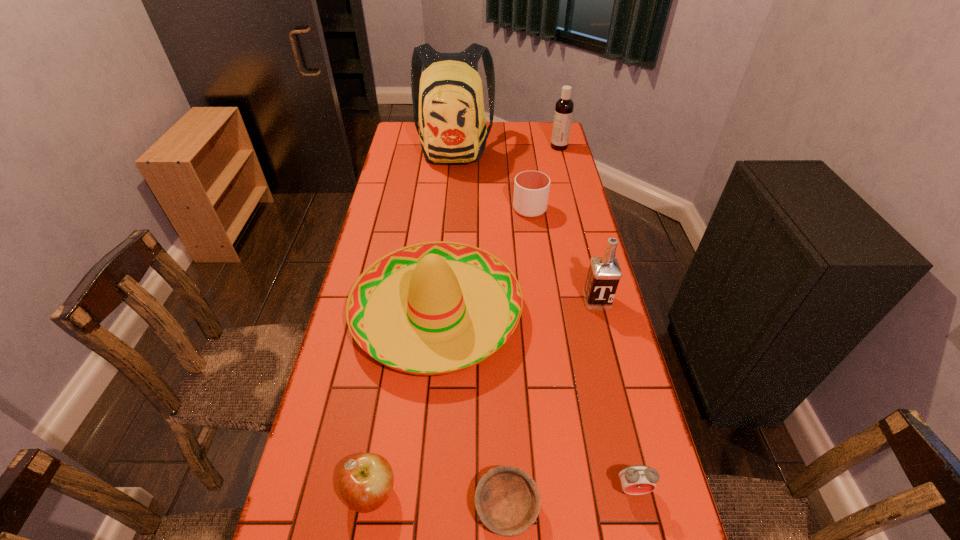
Locate an element on the screen. The height and width of the screenshot is (540, 960). the tallest object is located at coordinates pos(447,98).

Locate an element on the screen. dishwasher detergent is located at coordinates (564, 106).

Where is `vodka`? vodka is located at coordinates (604, 273).

The width and height of the screenshot is (960, 540). I want to click on sombrero, so click(x=433, y=308).

Locate an element on the screen. the third farthest object is located at coordinates 531,188.

Locate an element on the screen. the fourth object from right to left is located at coordinates (531, 188).

Find the location of a particular element. This screenshot has width=960, height=540. alarm clock is located at coordinates pos(638,479).

This screenshot has width=960, height=540. Find the location of `apple`. apple is located at coordinates (366, 480).

Image resolution: width=960 pixels, height=540 pixels. Find the location of `vacant space located on the front-facing side of the tallest object`. vacant space located on the front-facing side of the tallest object is located at coordinates (450, 193).

Find the location of a particular element. The image size is (960, 540). vacant space located on the label side of the dishwasher detergent is located at coordinates (523, 147).